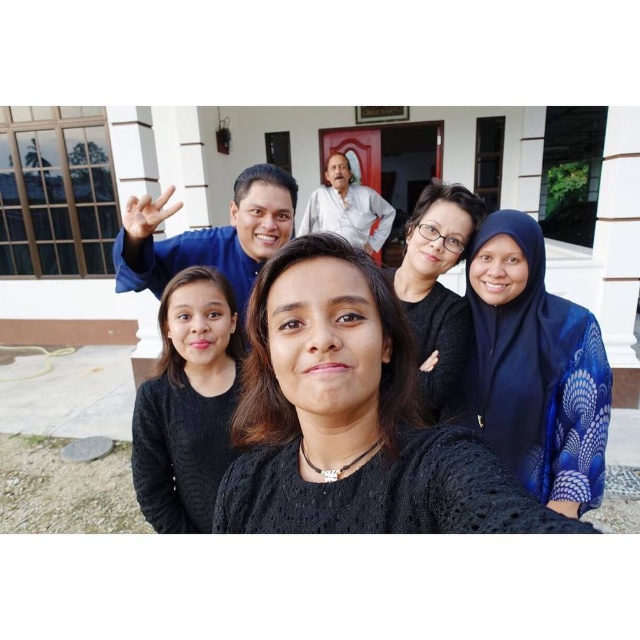
Question: Is black matte dress at center further to camera compared to blue silk hijab at right?

Choices:
 (A) yes
 (B) no

Answer: (B)

Question: Does black matte dress at center appear on the right side of black knitted sweater at center?

Choices:
 (A) yes
 (B) no

Answer: (A)

Question: Which point is closer to the camera?

Choices:
 (A) black matte glasses at center
 (B) black matte dress at center
 (C) white cotton shirt at upper center
 (D) blue silk hijab at right

Answer: (B)

Question: Which of these objects is positioned farthest from the black knitted sweater at center?

Choices:
 (A) black matte glasses at center
 (B) black matte dress at center

Answer: (A)

Question: Does black knitted sweater at center appear on the right side of black matte glasses at center?

Choices:
 (A) no
 (B) yes

Answer: (A)

Question: Which object is closer to the camera taking this photo?

Choices:
 (A) white cotton shirt at upper center
 (B) black matte dress at center
 (C) black knitted sweater at center

Answer: (B)